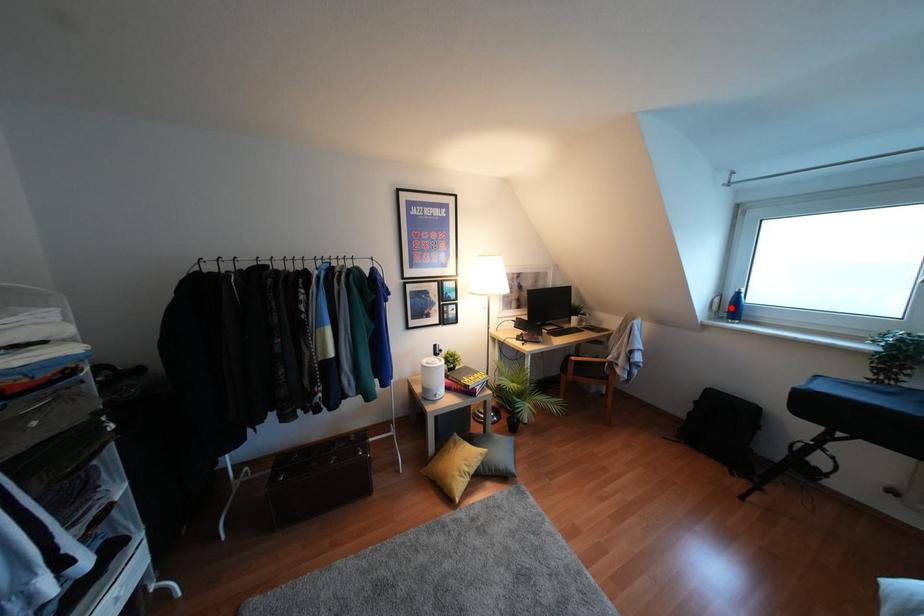
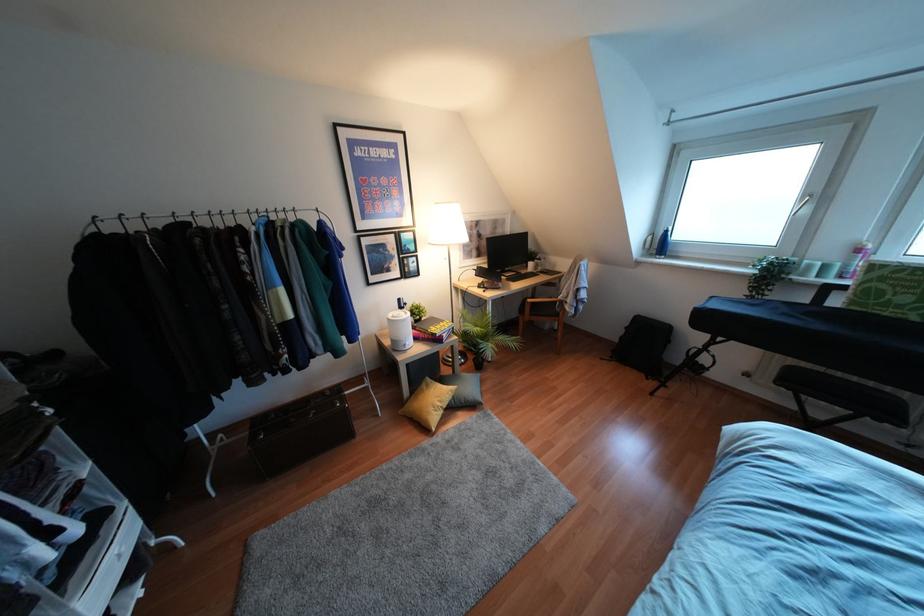
The point at the highlighted location is marked in the first image. Where is the corresponding point in the second image?

(660, 245)